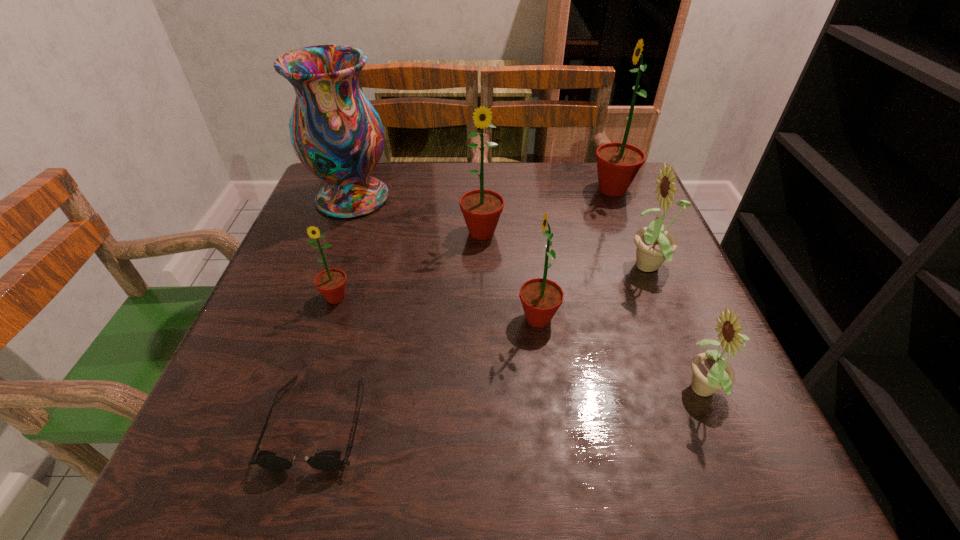
Locate an element on the screen. This screenshot has width=960, height=540. vacant point that satisfies the following two spatial constraints: 1. on the front-facing side of the bigger yellow sunflower; 2. on the front-facing side of the sunglasses is located at coordinates click(x=713, y=422).